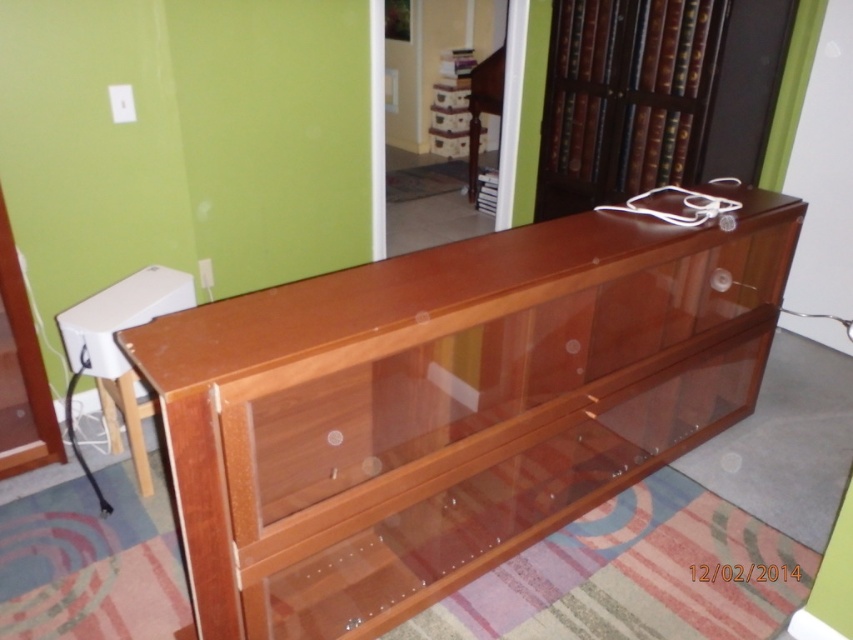
You are moving a large painting that is 2 meters wide. You want to place it on the wall between the glossy wood dresser at center and the brown wooden bookshelf at upper right. Is there enough space for the painting?

The glossy wood dresser at center is to the left of the brown wooden bookshelf at upper right, but the distance between them isn not specified. Without knowing the exact spacing, it is impossible to determine if the 2 meter wide painting will fit.